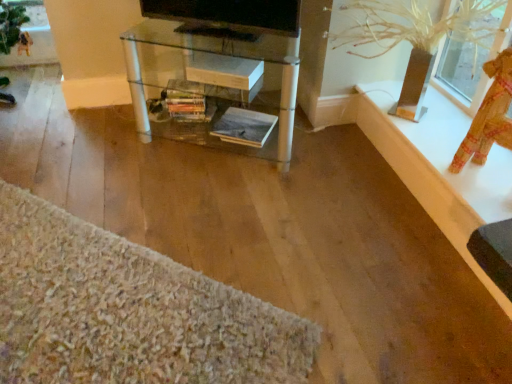
Where is `unoccupied region to the right of textured beige rug at lower left`? The height and width of the screenshot is (384, 512). unoccupied region to the right of textured beige rug at lower left is located at coordinates (325, 247).